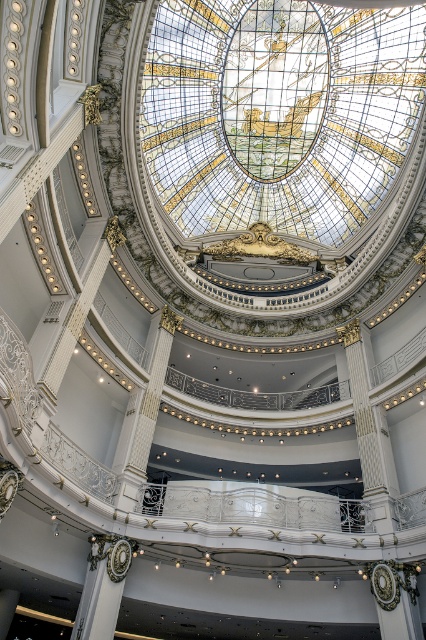
Question: Which object appears closest to the camera in this image?

Choices:
 (A) gold ornate column at center
 (B) white marble column at center

Answer: (A)

Question: Is gold ornate column at center further to camera compared to white marble column at center?

Choices:
 (A) no
 (B) yes

Answer: (A)

Question: Which of the following is the farthest from the observer?

Choices:
 (A) white marble column at center
 (B) gold ornate column at center

Answer: (A)

Question: Does gold ornate column at center appear on the left side of white marble column at center?

Choices:
 (A) yes
 (B) no

Answer: (A)

Question: Can you confirm if gold ornate column at center is wider than white marble column at center?

Choices:
 (A) no
 (B) yes

Answer: (A)